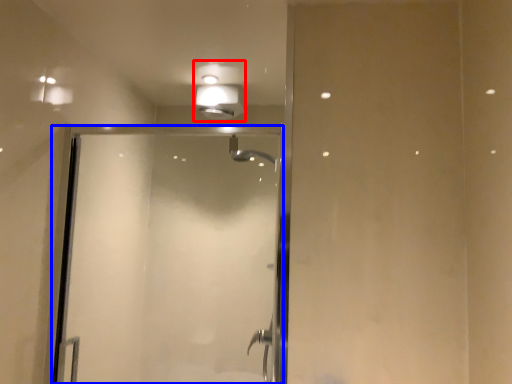
Question: Among these objects, which one is nearest to the camera, light fixture (highlighted by a red box) or screen door (highlighted by a blue box)?

Choices:
 (A) light fixture
 (B) screen door

Answer: (B)